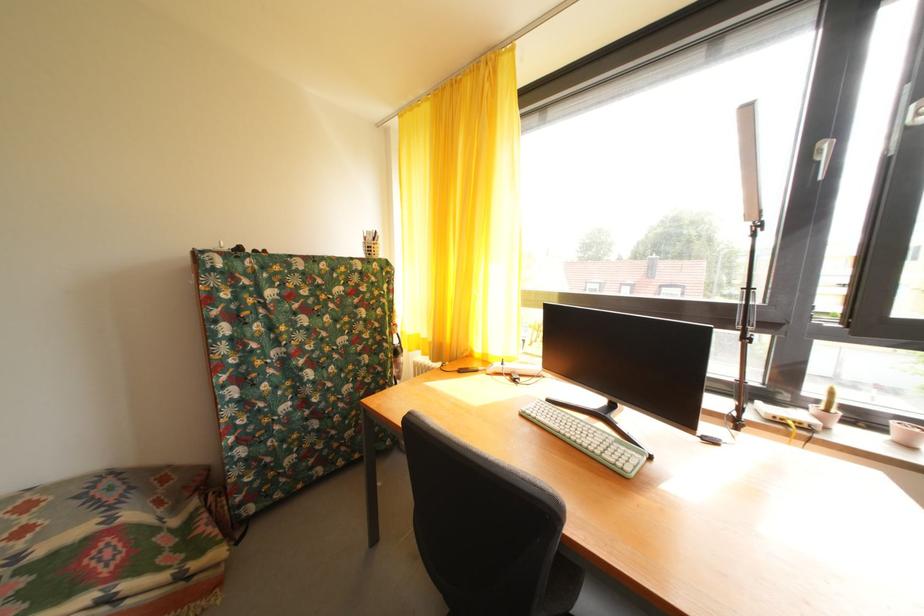
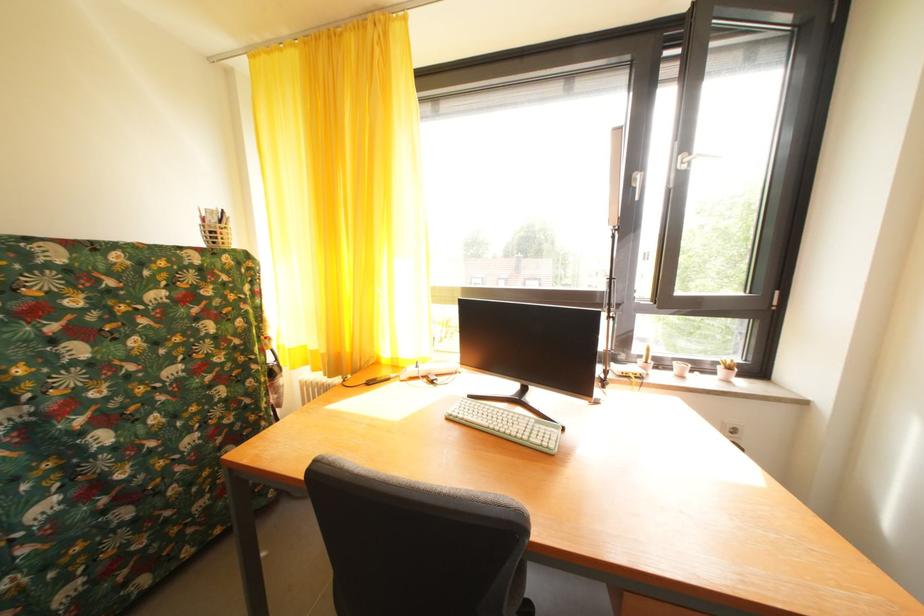
The point at (371, 246) is marked in the first image. Where is the corresponding point in the second image?

(209, 229)